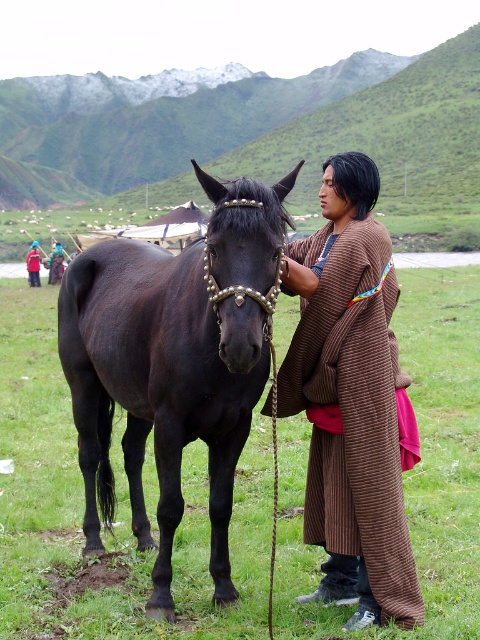
Question: Which of the following is the closest to the observer?

Choices:
 (A) red cotton robe at center
 (B) shiny black horse at center

Answer: (B)

Question: Can you confirm if brown textured robe at center is thinner than red cotton robe at center?

Choices:
 (A) no
 (B) yes

Answer: (B)

Question: Is brown textured robe at center below red cotton robe at center?

Choices:
 (A) yes
 (B) no

Answer: (A)

Question: Which of the following is the farthest from the observer?

Choices:
 (A) (351, 378)
 (B) (36, 260)
 (C) (263, 298)

Answer: (B)

Question: Which point is closer to the camera?

Choices:
 (A) (370, 392)
 (B) (29, 250)
 (C) (72, 378)

Answer: (A)

Question: Is brown textured robe at center wider than red cotton robe at center?

Choices:
 (A) no
 (B) yes

Answer: (A)